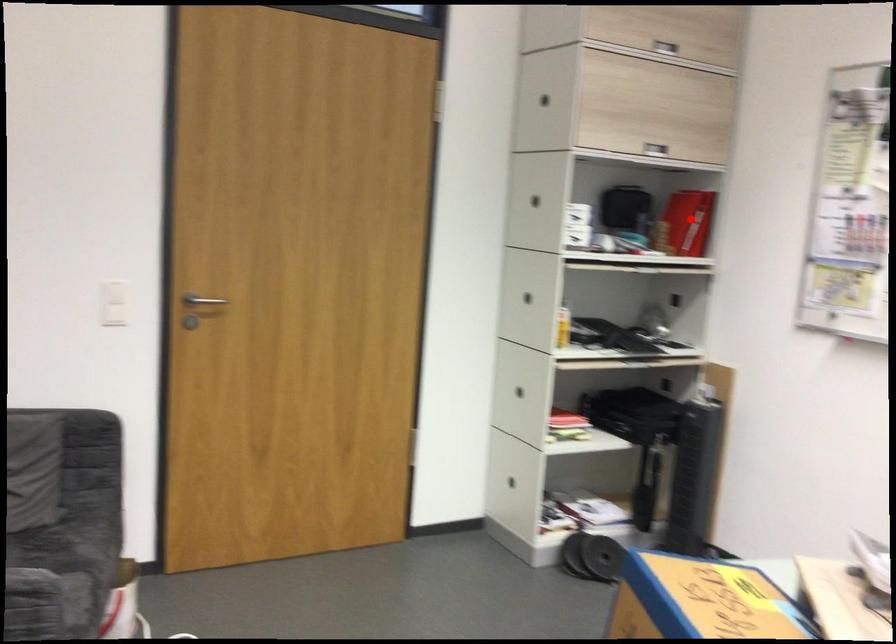
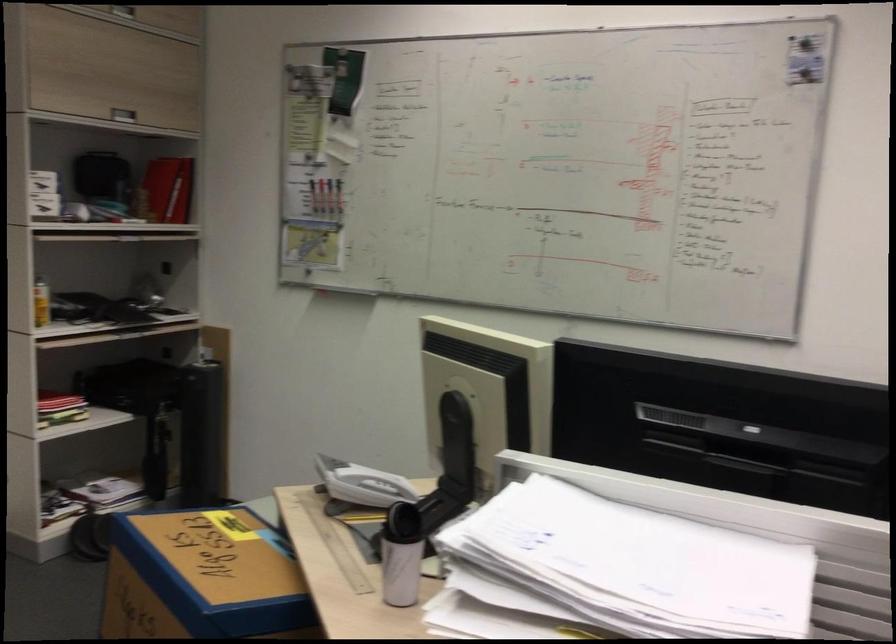
Locate, in the second image, the point that corresponds to the highlighted location in the first image.

(166, 190)